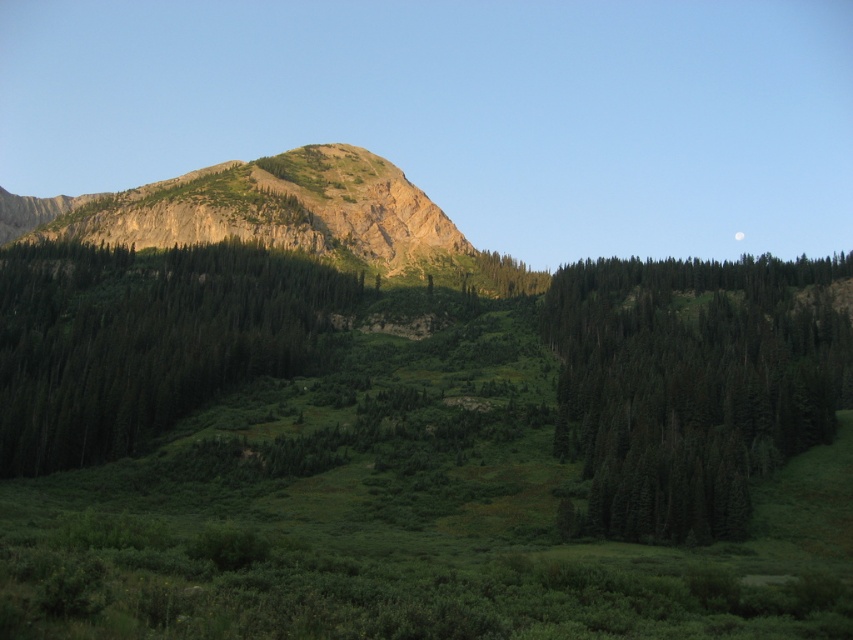
Question: Which point is farther to the camera?

Choices:
 (A) (102, 205)
 (B) (846, 330)
 (C) (248, 253)

Answer: (A)

Question: Which object is positioned farthest from the rustic stone mountain at center?

Choices:
 (A) green matte trees at right
 (B) green textured trees at center

Answer: (A)

Question: Which object appears closest to the camera in this image?

Choices:
 (A) green matte trees at right
 (B) rustic stone mountain at center

Answer: (A)

Question: Is green textured trees at center behind rustic stone mountain at center?

Choices:
 (A) yes
 (B) no

Answer: (B)

Question: Where is green textured trees at center located in relation to rustic stone mountain at center in the image?

Choices:
 (A) below
 (B) above

Answer: (A)

Question: From the image, what is the correct spatial relationship of green textured trees at center in relation to rustic stone mountain at center?

Choices:
 (A) right
 (B) left

Answer: (A)